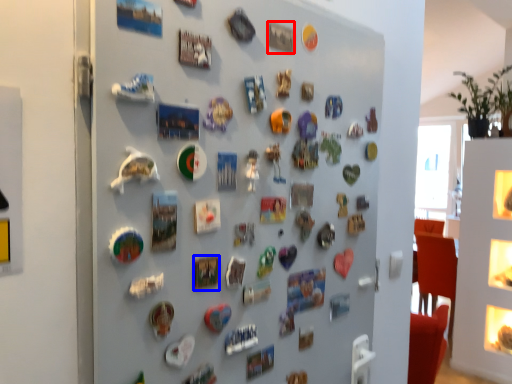
Question: Which object is further to the camera taking this photo, button (highlighted by a red box) or button (highlighted by a blue box)?

Choices:
 (A) button
 (B) button

Answer: (A)